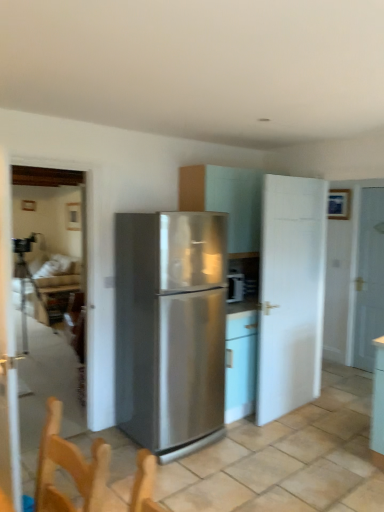
Question: Is stainless steel refrigerator at center closer to camera compared to wooden table at lower left?

Choices:
 (A) no
 (B) yes

Answer: (B)

Question: Is stainless steel refrigerator at center facing away from wooden table at lower left?

Choices:
 (A) no
 (B) yes

Answer: (B)

Question: Can you confirm if stainless steel refrigerator at center is smaller than wooden table at lower left?

Choices:
 (A) yes
 (B) no

Answer: (B)

Question: From the image's perspective, would you say stainless steel refrigerator at center is shown under wooden table at lower left?

Choices:
 (A) no
 (B) yes

Answer: (A)

Question: Is stainless steel refrigerator at center not inside wooden table at lower left?

Choices:
 (A) yes
 (B) no

Answer: (A)

Question: In terms of height, does white matte door at right, the second door viewed from the left, look taller or shorter compared to matte white cabinet at center?

Choices:
 (A) tall
 (B) short

Answer: (A)

Question: Considering their positions, is white matte door at right, placed as the 1th door when sorted from back to front, located in front of or behind matte white cabinet at center?

Choices:
 (A) front
 (B) behind

Answer: (B)

Question: Would you say white matte door at right, the second door viewed from the left, is to the left or to the right of matte white cabinet at center in the picture?

Choices:
 (A) right
 (B) left

Answer: (A)

Question: Choose the correct answer: Is white matte door at right, the second door viewed from the left, inside matte white cabinet at center or outside it?

Choices:
 (A) outside
 (B) inside

Answer: (A)

Question: Looking at their shapes, would you say white matte door at center-right, placed as the first door when sorted from left to right, is wider or thinner than transparent glass door at left, positioned as the second glass door in back-to-front order?

Choices:
 (A) thin
 (B) wide

Answer: (A)

Question: From a real-world perspective, is white matte door at center-right, acting as the 1th door starting from the front, positioned above or below transparent glass door at left, which is the first glass door from front to back?

Choices:
 (A) below
 (B) above

Answer: (A)

Question: Is point (288, 197) closer or farther from the camera than point (11, 310)?

Choices:
 (A) closer
 (B) farther

Answer: (B)

Question: From the image's perspective, is white matte door at center-right, placed as the first door when sorted from left to right, above or below transparent glass door at left, which is the first glass door from front to back?

Choices:
 (A) above
 (B) below

Answer: (B)

Question: Relative to stainless steel refrigerator at center, is clear glass door at left, which ranks as the 2th glass door in front-to-back order, in front or behind?

Choices:
 (A) front
 (B) behind

Answer: (B)

Question: In terms of size, does clear glass door at left, the 1th glass door viewed from the back, appear bigger or smaller than stainless steel refrigerator at center?

Choices:
 (A) small
 (B) big

Answer: (A)